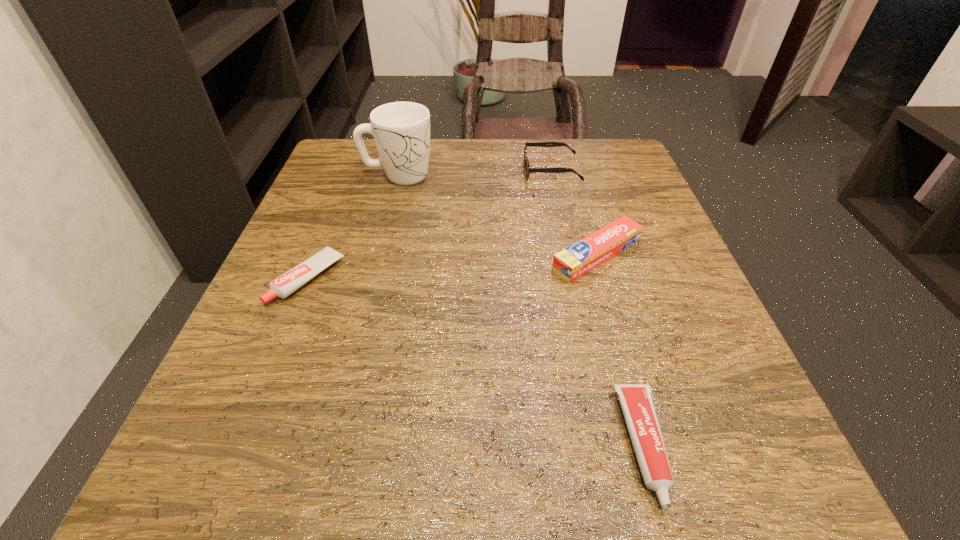
The width and height of the screenshot is (960, 540). In order to click on mug in this screenshot , I will do `click(401, 130)`.

Find the location of a particular element. The image size is (960, 540). the second tallest object is located at coordinates (528, 169).

The height and width of the screenshot is (540, 960). I want to click on the leftmost toothpaste, so click(x=283, y=286).

Identify the location of the nearest toothpaste. (636, 401).

You are a GUI agent. You are given a task and a screenshot of the screen. Output one action in this format:
    pyautogui.click(x=<x>, y=<y>)
    Task: Click on the free space located on the side of the tallest object with the handle
    
    Given the screenshot: What is the action you would take?
    pyautogui.click(x=558, y=175)

The height and width of the screenshot is (540, 960). I want to click on vacant space located 0.110m at the front lenses of the sunglasses, so click(x=475, y=170).

At what (x,y) coordinates should I click in order to perform the action: click on vacant area located at the front lenses of the sunglasses. Please return your answer as a coordinate pair (x, y). This screenshot has height=540, width=960. Looking at the image, I should click on (493, 170).

Identify the location of vacant space located at the front lenses of the sunglasses. The height and width of the screenshot is (540, 960). (349, 170).

What are the coordinates of `free space located 0.180m on the front of the leftmost toothpaste` in the screenshot? It's located at (253, 416).

Locate an element on the screen. This screenshot has height=540, width=960. mug that is at the far edge is located at coordinates (401, 130).